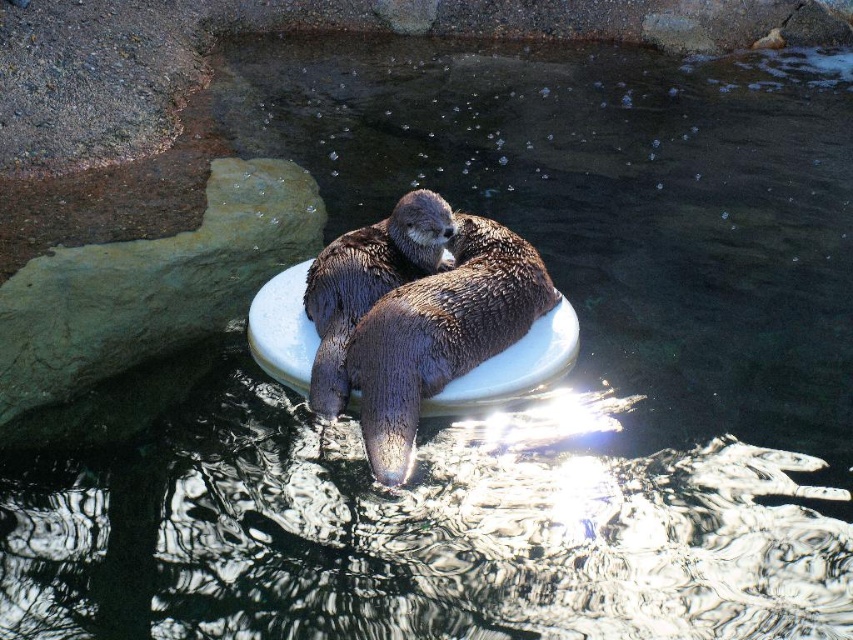
Looking at this image, you are a zookeeper observing two otters on a floating platform. You notice a brown fuzzy otter at center and a shiny brown otter at center. Which otter is resting on top of the other?

The shiny brown otter at center is resting on top of the brown fuzzy otter at center.

You are a zookeeper standing at the edge of the otter enclosure. You want to toss a small treat to the brown fuzzy otter at center. The treat can travel 3 meters. Will it reach the otter?

The brown fuzzy otter at center is 2.84 meters away from the camera. Since the treat can travel 3 meters, it will reach the otter.

You are a zookeeper observing two otters on a floating platform. You need to determine if the brown fuzzy otter at center can fit alongside the shiny brown otter at center without overlapping. Based on their widths, can they both fit side by side?

The brown fuzzy otter at center might be wider than the shiny brown otter at center. If the brown fuzzy otter at center is indeed wider, they may not fit side by side without overlapping. However, if they are similar in width, they could potentially fit. The exact width difference isn